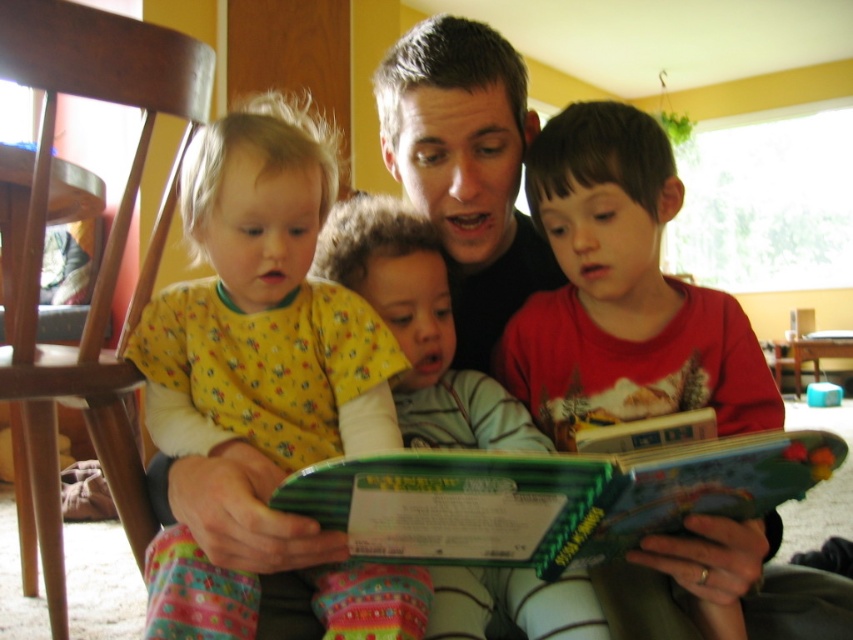
Can you confirm if hardcover book at center is positioned above fluffy white blanket at center?

No.

Is point (535, 460) positioned in front of point (556, 598)?

Yes, point (535, 460) is in front of point (556, 598).

You are a GUI agent. You are given a task and a screenshot of the screen. Output one action in this format:
    pyautogui.click(x=<x>, y=<y>)
    Task: Click on the hardcover book at center
    The height and width of the screenshot is (640, 853).
    Given the screenshot: What is the action you would take?
    pyautogui.click(x=550, y=497)

At what (x,y) coordinates should I click in order to perform the action: click on hardcover book at center. Please return your answer as a coordinate pair (x, y). This screenshot has height=640, width=853. Looking at the image, I should click on (550, 497).

Is hardcover book at center wider than wooden chair at left?

No, hardcover book at center is not wider than wooden chair at left.

Is hardcover book at center taller than wooden chair at left?

No, hardcover book at center is not taller than wooden chair at left.

Where is `hardcover book at center`? This screenshot has height=640, width=853. hardcover book at center is located at coordinates (550, 497).

Which of these two, wooden chair at left or fluffy white blanket at center, stands shorter?

Standing shorter between the two is fluffy white blanket at center.

Can you confirm if wooden chair at left is positioned below fluffy white blanket at center?

No.

Where is `wooden chair at left`? wooden chair at left is located at coordinates (102, 253).